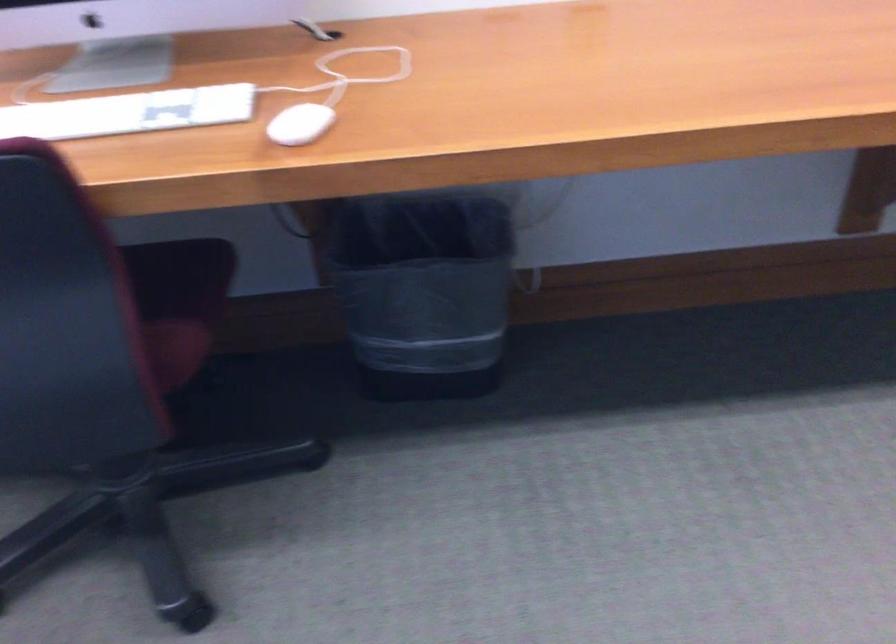
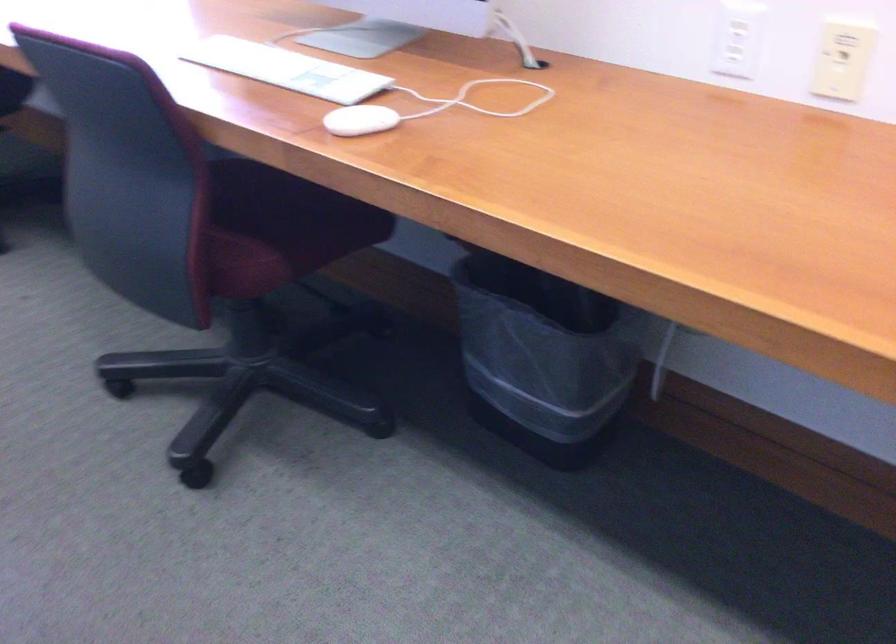
Where in the second image is the point corresponding to the point at 307,120 from the first image?

(359, 120)